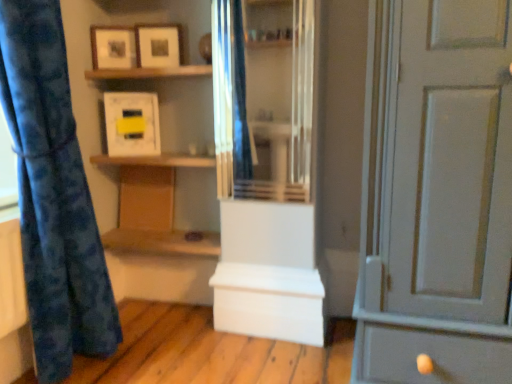
Measure the distance between point (110, 72) and camera.

The depth of point (110, 72) is 6.30 feet.

The width and height of the screenshot is (512, 384). In order to click on wooden shelf at upper center, arranged as the 1th shelf when viewed from the top in this screenshot , I will do `click(149, 72)`.

Locate an element on the screen. matte white picture frame at upper left, arranged as the second picture frame when ordered from the bottom is located at coordinates click(113, 47).

Image resolution: width=512 pixels, height=384 pixels. What do you see at coordinates (263, 98) in the screenshot? I see `clear glass cabinet at center` at bounding box center [263, 98].

What do you see at coordinates (156, 160) in the screenshot? This screenshot has width=512, height=384. I see `wooden shelf at center, arranged as the 1th shelf when ordered from the bottom` at bounding box center [156, 160].

The image size is (512, 384). Find the location of `matte brown cabinet at center, which is the second cabinetry in right-to-left order`. matte brown cabinet at center, which is the second cabinetry in right-to-left order is located at coordinates 146,197.

What do you see at coordinates (146, 197) in the screenshot? Image resolution: width=512 pixels, height=384 pixels. I see `matte brown cabinet at center, acting as the 1th cabinetry starting from the top` at bounding box center [146, 197].

The width and height of the screenshot is (512, 384). Identify the location of wooden shelf at upper center, arranged as the 1th shelf when viewed from the top. (149, 72).

From the image's perspective, is matte brown cabinet at center, arranged as the second cabinetry when viewed from the front, positioned above or below wooden shelf at center, arranged as the 1th shelf when ordered from the bottom?

From the image's perspective, matte brown cabinet at center, arranged as the second cabinetry when viewed from the front, appears below wooden shelf at center, arranged as the 1th shelf when ordered from the bottom.

Is matte brown cabinet at center, positioned as the first cabinetry in left-to-right order, bigger or smaller than wooden shelf at center, the 2th shelf in the top-to-bottom sequence?

Considering their sizes, matte brown cabinet at center, positioned as the first cabinetry in left-to-right order, takes up less space than wooden shelf at center, the 2th shelf in the top-to-bottom sequence.

Between matte brown cabinet at center, which is counted as the 2th cabinetry, starting from the bottom, and wooden shelf at center, the 2th shelf in the top-to-bottom sequence, which one is positioned behind?

matte brown cabinet at center, which is counted as the 2th cabinetry, starting from the bottom, is further away from the camera.

Looking at the image, does wooden shelf at center, the 2th shelf in the top-to-bottom sequence, seem bigger or smaller compared to matte brown cabinet at center, which is the second cabinetry in right-to-left order?

Considering their sizes, wooden shelf at center, the 2th shelf in the top-to-bottom sequence, takes up more space than matte brown cabinet at center, which is the second cabinetry in right-to-left order.

Which is more to the right, wooden shelf at center, arranged as the 1th shelf when ordered from the bottom, or matte brown cabinet at center, positioned as the first cabinetry in left-to-right order?

wooden shelf at center, arranged as the 1th shelf when ordered from the bottom, is more to the right.

Relative to matte brown cabinet at center, which is counted as the 2th cabinetry, starting from the bottom, is wooden shelf at center, arranged as the 1th shelf when ordered from the bottom, in front or behind?

Visually, wooden shelf at center, arranged as the 1th shelf when ordered from the bottom, is located in front of matte brown cabinet at center, which is counted as the 2th cabinetry, starting from the bottom.

Is wooden shelf at center, the 2th shelf in the top-to-bottom sequence, far away from matte brown cabinet at center, acting as the 1th cabinetry starting from the top?

No.

Would you say wooden shelf at center, the 2th shelf in the top-to-bottom sequence, is a long distance from matte white picture frame at upper center, placed as the third picture frame when sorted from bottom to top?

wooden shelf at center, the 2th shelf in the top-to-bottom sequence, is actually quite close to matte white picture frame at upper center, placed as the third picture frame when sorted from bottom to top.

From a real-world perspective, count 2nd shelfs downward from the matte white picture frame at upper center, placed as the third picture frame when sorted from bottom to top, and point to it. Please provide its 2D coordinates.

[(156, 160)]

Consider the image. Considering the positions of objects wooden shelf at center, the 2th shelf in the top-to-bottom sequence, and matte white picture frame at upper center, placed as the third picture frame when sorted from bottom to top, in the image provided, who is behind, wooden shelf at center, the 2th shelf in the top-to-bottom sequence, or matte white picture frame at upper center, placed as the third picture frame when sorted from bottom to top,?

matte white picture frame at upper center, placed as the third picture frame when sorted from bottom to top, is further from the camera.

Is white painted wood door at right shorter than matte brown cabinet at center, positioned as the first cabinetry in left-to-right order?

In fact, white painted wood door at right may be taller than matte brown cabinet at center, positioned as the first cabinetry in left-to-right order.

Considering the relative sizes of white painted wood door at right and matte brown cabinet at center, arranged as the first cabinetry when viewed from the back, in the image provided, is white painted wood door at right wider than matte brown cabinet at center, arranged as the first cabinetry when viewed from the back,?

Yes.

Is white painted wood door at right smaller than matte brown cabinet at center, acting as the 1th cabinetry starting from the top?

No.

How distant is white painted wood door at right from matte brown cabinet at center, arranged as the second cabinetry when viewed from the front?

1.25 meters.

Is point (255, 74) closer or farther from the camera than point (148, 54)?

Point (255, 74) is positioned farther from the camera compared to point (148, 54).

Who is more distant, clear glass cabinet at center or matte white picture frame at upper center, placed as the third picture frame when sorted from bottom to top?

matte white picture frame at upper center, placed as the third picture frame when sorted from bottom to top, is further away from the camera.

From the image's perspective, between matte white picture frame at upper left, arranged as the second picture frame when ordered from the bottom, and clear glass cabinet at center, who is located below?

From the image's view, clear glass cabinet at center is below.

Is matte white picture frame at upper left, arranged as the second picture frame when ordered from the bottom, closer to camera compared to clear glass cabinet at center?

No, matte white picture frame at upper left, arranged as the second picture frame when ordered from the bottom, is further to the viewer.

Considering the points (117, 42) and (261, 134), which point is in front, point (117, 42) or point (261, 134)?

The point (117, 42) is in front.

From a real-world perspective, does matte white picture frame at upper center, which ranks as the 1th picture frame in top-to-bottom order, sit lower than wooden shelf at upper center, arranged as the 1th shelf when viewed from the top?

No, from a real-world perspective, matte white picture frame at upper center, which ranks as the 1th picture frame in top-to-bottom order, is not under wooden shelf at upper center, arranged as the 1th shelf when viewed from the top.

Does matte white picture frame at upper center, placed as the third picture frame when sorted from bottom to top, have a lesser height compared to wooden shelf at upper center, the 2th shelf from the bottom?

Incorrect, the height of matte white picture frame at upper center, placed as the third picture frame when sorted from bottom to top, does not fall short of that of wooden shelf at upper center, the 2th shelf from the bottom.

How distant is matte white picture frame at upper center, which ranks as the 1th picture frame in top-to-bottom order, from wooden shelf at upper center, the 2th shelf from the bottom?

The distance of matte white picture frame at upper center, which ranks as the 1th picture frame in top-to-bottom order, from wooden shelf at upper center, the 2th shelf from the bottom, is 3.98 inches.

Between matte white picture frame at upper center, which ranks as the 1th picture frame in top-to-bottom order, and wooden shelf at upper center, arranged as the 1th shelf when viewed from the top, which one is positioned behind?

Positioned behind is matte white picture frame at upper center, which ranks as the 1th picture frame in top-to-bottom order.

From a real-world perspective, count 1st cabinetrys downward from the wooden shelf at center, arranged as the 1th shelf when ordered from the bottom, and point to it. Please provide its 2D coordinates.

[(146, 197)]

Locate an element on the screen. The image size is (512, 384). shelf that is the 2nd one when counting rightward from the matte brown cabinet at center, arranged as the first cabinetry when viewed from the back is located at coordinates (156, 160).

Based on their spatial positions, is matte brown cabinet at center, which is counted as the 2th cabinetry, starting from the bottom, or wooden shelf at center, the 2th shelf in the top-to-bottom sequence, closer to matte white picture frame at upper center, arranged as the 3th picture frame when viewed from the top?

→ wooden shelf at center, the 2th shelf in the top-to-bottom sequence.

Based on the photo, estimate the real-world distances between objects in this image. Which object is further from wooden shelf at center, arranged as the 1th shelf when ordered from the bottom, wooden shelf at upper center, the 2th shelf from the bottom, or white painted wood door at right?

Among the two, white painted wood door at right is located further to wooden shelf at center, arranged as the 1th shelf when ordered from the bottom.

Which object lies nearer to the anchor point clear glass cabinet at center, matte brown cabinet at center, positioned as the first cabinetry in left-to-right order, or matte white picture frame at upper left, arranged as the second picture frame when ordered from the bottom?

The object closer to clear glass cabinet at center is matte brown cabinet at center, positioned as the first cabinetry in left-to-right order.

Based on their spatial positions, is wooden shelf at center, the 2th shelf in the top-to-bottom sequence, or wooden shelf at upper center, arranged as the 1th shelf when viewed from the top, closer to white matte storage box at center, which ranks as the 1th cabinetry in bottom-to-top order?

wooden shelf at center, the 2th shelf in the top-to-bottom sequence, is closer to white matte storage box at center, which ranks as the 1th cabinetry in bottom-to-top order.

Which object lies nearer to the anchor point white matte storage box at center, which ranks as the 1th cabinetry in front-to-back order, matte white picture frame at upper left, arranged as the second picture frame when ordered from the bottom, or matte brown cabinet at center, arranged as the second cabinetry when viewed from the front?

The object closer to white matte storage box at center, which ranks as the 1th cabinetry in front-to-back order, is matte brown cabinet at center, arranged as the second cabinetry when viewed from the front.

Considering their positions, is matte brown cabinet at center, which is counted as the 2th cabinetry, starting from the bottom, positioned further to wooden shelf at center, arranged as the 1th shelf when ordered from the bottom, than white painted wood door at right?

white painted wood door at right is positioned further to the anchor wooden shelf at center, arranged as the 1th shelf when ordered from the bottom.

Looking at the image, which one is located closer to blue fabric curtain at left, wooden shelf at center, the 2th shelf in the top-to-bottom sequence, or white matte storage box at center, which ranks as the 1th cabinetry in bottom-to-top order?

wooden shelf at center, the 2th shelf in the top-to-bottom sequence, lies closer to blue fabric curtain at left than the other object.

When comparing their distances from clear glass cabinet at center, does blue fabric curtain at left or wooden shelf at upper center, arranged as the 1th shelf when viewed from the top, seem closer?

wooden shelf at upper center, arranged as the 1th shelf when viewed from the top, is positioned closer to the anchor clear glass cabinet at center.

The image size is (512, 384). In order to click on picture frame between clear glass cabinet at center and white matte storage box at center, which ranks as the 1th cabinetry in bottom-to-top order, in the vertical direction in this screenshot , I will do `click(132, 123)`.

Find the location of a particular element. The height and width of the screenshot is (384, 512). picture frame that lies between matte white picture frame at upper left, arranged as the second picture frame when ordered from the bottom, and matte brown cabinet at center, positioned as the first cabinetry in left-to-right order, from top to bottom is located at coordinates click(132, 123).

Identify the location of shelf between wooden shelf at upper center, the 2th shelf from the bottom, and clear glass cabinet at center. This screenshot has width=512, height=384. (156, 160).

Identify the location of picture frame between matte white picture frame at upper center, arranged as the 3th picture frame when viewed from the top, and white painted wood door at right from left to right. (158, 45).